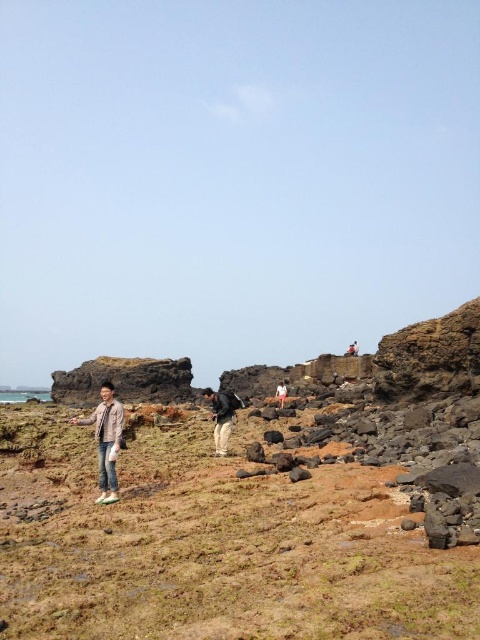
Question: Which point is closer to the camera taking this photo?

Choices:
 (A) (113, 483)
 (B) (35, 566)
 (C) (211, 404)

Answer: (B)

Question: Which of the following is the closest to the observer?

Choices:
 (A) light brown leather jacket at center
 (B) brown grassy terrain at lower left
 (C) pink fabric at center
 (D) matte black backpack at center

Answer: (B)

Question: Is brown grassy terrain at lower left positioned behind light brown leather jacket at center?

Choices:
 (A) no
 (B) yes

Answer: (A)

Question: Considering the relative positions of brown grassy terrain at lower left and light brown leather jacket at center in the image provided, where is brown grassy terrain at lower left located with respect to light brown leather jacket at center?

Choices:
 (A) left
 (B) right

Answer: (B)

Question: Which object is positioned farthest from the pink fabric at center?

Choices:
 (A) light brown leather jacket at center
 (B) brown grassy terrain at lower left
 (C) matte black backpack at center

Answer: (B)

Question: Is brown grassy terrain at lower left in front of light brown leather jacket at center?

Choices:
 (A) yes
 (B) no

Answer: (A)